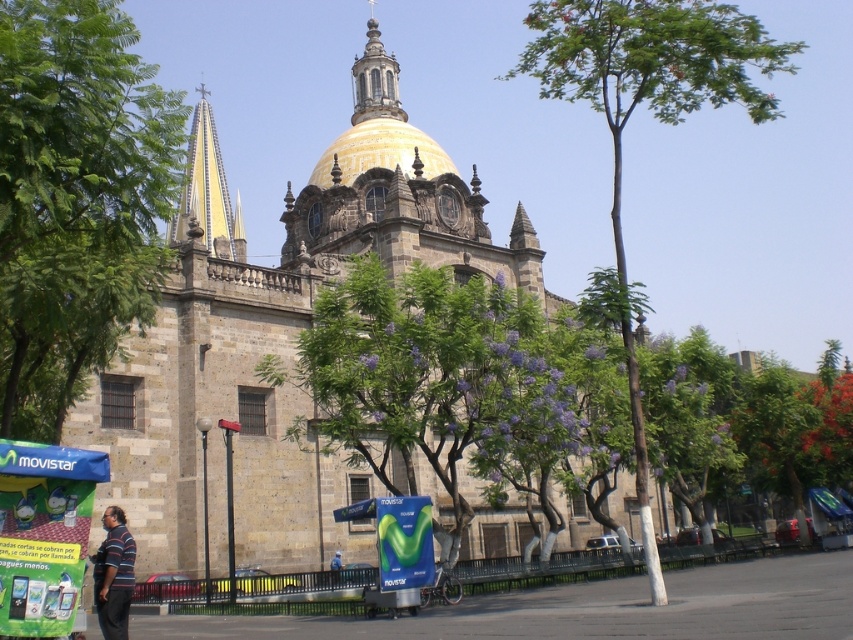
Question: Does stone church at center appear on the left side of gold/golden dome at center?

Choices:
 (A) no
 (B) yes

Answer: (A)

Question: Which point appears closest to the camera in this image?

Choices:
 (A) (39, 237)
 (B) (334, 560)

Answer: (A)

Question: From the image, what is the correct spatial relationship of green leafy tree at center in relation to yellow striped stone spire at upper left?

Choices:
 (A) left
 (B) right

Answer: (B)

Question: Can you confirm if green leafy tree at left is positioned above green leafy tree at center?

Choices:
 (A) yes
 (B) no

Answer: (B)

Question: Which point is farther to the camera?

Choices:
 (A) (358, 106)
 (B) (335, 561)
 (C) (184, 205)

Answer: (C)

Question: Which point appears farthest from the camera in this image?

Choices:
 (A) (383, 64)
 (B) (113, 509)
 (C) (10, 378)

Answer: (A)